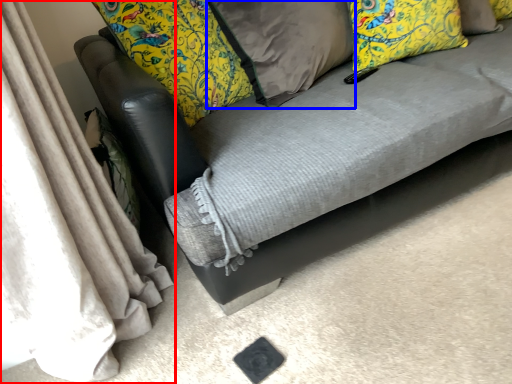
Question: Which point is closer to the camera, curtain (highlighted by a red box) or pillow (highlighted by a blue box)?

Choices:
 (A) curtain
 (B) pillow

Answer: (A)